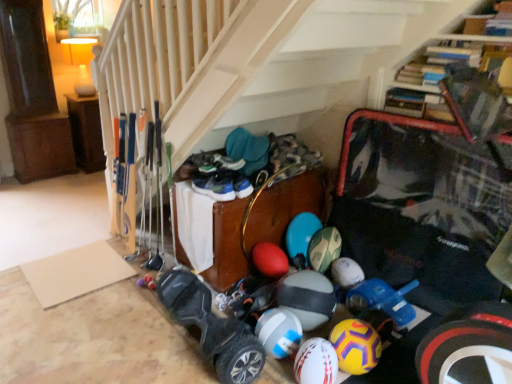
Question: Should I look upward or downward to see white matte bowling ball at lower center, placed as the 1th bowling ball when sorted from right to left?

Choices:
 (A) up
 (B) down

Answer: (B)

Question: Would you consider white matte bowling ball at center, which is counted as the first bowling ball, starting from the left, to be distant from white matte bowling ball at lower center, placed as the 1th bowling ball when sorted from right to left?

Choices:
 (A) yes
 (B) no

Answer: (B)

Question: Does white matte bowling ball at center, which is counted as the first bowling ball, starting from the left, have a lesser height compared to white matte bowling ball at lower center, which is counted as the third bowling ball, starting from the left?

Choices:
 (A) yes
 (B) no

Answer: (A)

Question: Is white matte bowling ball at center, which is counted as the first bowling ball, starting from the left, wider than white matte bowling ball at lower center, placed as the 1th bowling ball when sorted from right to left?

Choices:
 (A) no
 (B) yes

Answer: (B)

Question: Can we say white matte bowling ball at center, which ranks as the 3th bowling ball in right-to-left order, lies outside white matte bowling ball at lower center, which is counted as the third bowling ball, starting from the left?

Choices:
 (A) yes
 (B) no

Answer: (A)

Question: Considering the relative sizes of white matte bowling ball at center, which is counted as the first bowling ball, starting from the left, and white matte bowling ball at lower center, placed as the 1th bowling ball when sorted from right to left, in the image provided, is white matte bowling ball at center, which is counted as the first bowling ball, starting from the left, smaller than white matte bowling ball at lower center, placed as the 1th bowling ball when sorted from right to left,?

Choices:
 (A) no
 (B) yes

Answer: (B)

Question: Considering the relative sizes of white matte bowling ball at center, which ranks as the 3th bowling ball in right-to-left order, and white matte bowling ball at lower center, which is counted as the third bowling ball, starting from the left, in the image provided, is white matte bowling ball at center, which ranks as the 3th bowling ball in right-to-left order, taller than white matte bowling ball at lower center, which is counted as the third bowling ball, starting from the left,?

Choices:
 (A) no
 (B) yes

Answer: (A)

Question: Is brown wood cabinet at left, which is the 1th furniture from left to right, facing towards wooden chest at center, the first furniture viewed from the front?

Choices:
 (A) yes
 (B) no

Answer: (A)

Question: Does brown wood cabinet at left, the first furniture positioned from the back, have a smaller size compared to wooden chest at center, the second furniture positioned from the back?

Choices:
 (A) no
 (B) yes

Answer: (B)

Question: From a real-world perspective, is brown wood cabinet at left, which is the 1th furniture from left to right, positioned under wooden chest at center, the first furniture viewed from the front, based on gravity?

Choices:
 (A) no
 (B) yes

Answer: (A)

Question: Can you see brown wood cabinet at left, positioned as the second furniture in bottom-to-top order, touching wooden chest at center, the 1th furniture positioned from the bottom?

Choices:
 (A) yes
 (B) no

Answer: (B)

Question: From the image's perspective, is brown wood cabinet at left, the first furniture positioned from the back, below wooden chest at center, the 2th furniture from the top?

Choices:
 (A) yes
 (B) no

Answer: (B)

Question: Is brown wood cabinet at left, the first furniture positioned from the back, far from wooden chest at center, the 2th furniture from the top?

Choices:
 (A) yes
 (B) no

Answer: (A)

Question: Is brown wood cabinet at left, which is the 1th furniture from top to bottom, with white matte bowling ball at center, which is counted as the first bowling ball, starting from the left?

Choices:
 (A) yes
 (B) no

Answer: (B)